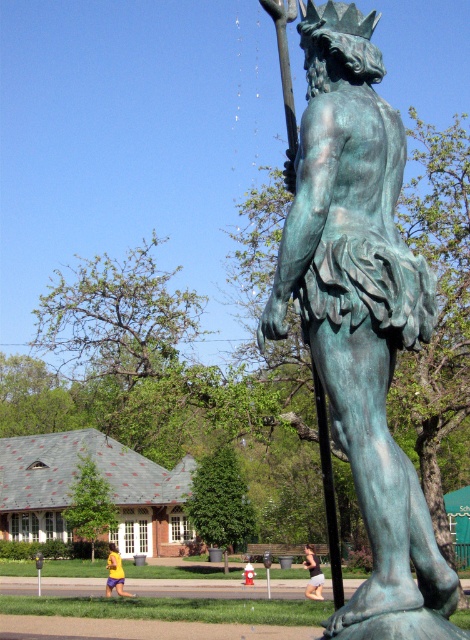
You are standing in front of the bronze statue and notice two fabrics in the scene. The black fabric shorts at lower center and the yellow fabric at lower left. Which fabric is nearer to you?

The black fabric shorts at lower center is closer to the viewer than the yellow fabric at lower left.